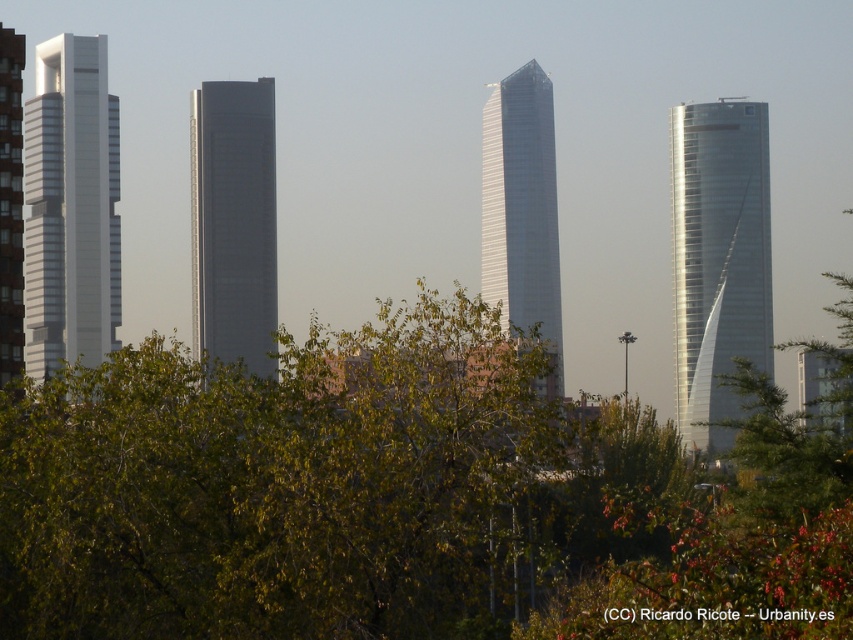
Which is in front, point (86, 81) or point (15, 156)?

Positioned in front is point (15, 156).

Consider the image. Does white smooth skyscraper at left have a lesser height compared to matte glass skyscraper at left?

Yes.

Locate an element on the screen. This screenshot has width=853, height=640. white smooth skyscraper at left is located at coordinates point(70,205).

Is point (241, 353) positioned before point (4, 317)?

That is True.

Does smooth glass skyscraper at center have a greater height compared to matte glass skyscraper at left?

Incorrect, smooth glass skyscraper at center's height is not larger of matte glass skyscraper at left's.

Does point (273, 308) lie in front of point (7, 372)?

Yes, point (273, 308) is in front of point (7, 372).

This screenshot has width=853, height=640. Find the location of `smooth glass skyscraper at center`. smooth glass skyscraper at center is located at coordinates (233, 221).

Is green leafy tree at center bigger than shiny glass skyscraper at center?

Indeed, green leafy tree at center has a larger size compared to shiny glass skyscraper at center.

Between point (64, 477) and point (550, 193), which one is positioned behind?

Point (550, 193)

Where is `green leafy tree at center`? green leafy tree at center is located at coordinates pyautogui.click(x=399, y=499).